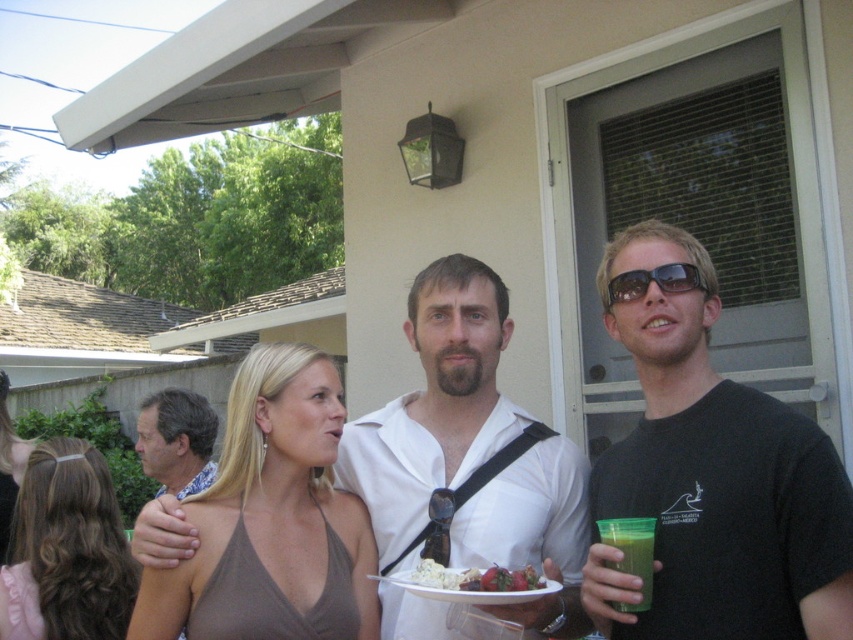
Does point (190, 404) come in front of point (625, 280)?

No, it is not.

Which is above, blue patterned shirt at left or sunglasses at center?

Positioned higher is sunglasses at center.

Find the location of a particular element. blue patterned shirt at left is located at coordinates (177, 440).

Identify the location of blue patterned shirt at left. The height and width of the screenshot is (640, 853). (177, 440).

Which is more to the right, black matte t-shirt at center or blue patterned shirt at left?

Positioned to the right is black matte t-shirt at center.

This screenshot has height=640, width=853. Find the location of `black matte t-shirt at center`. black matte t-shirt at center is located at coordinates (712, 480).

Is black matte t-shirt at center below sunglasses at center?

Correct, black matte t-shirt at center is located below sunglasses at center.

Which is behind, point (686, 486) or point (660, 289)?

The point (660, 289) is more distant.

Locate an element on the screen. The image size is (853, 640). black matte t-shirt at center is located at coordinates (712, 480).